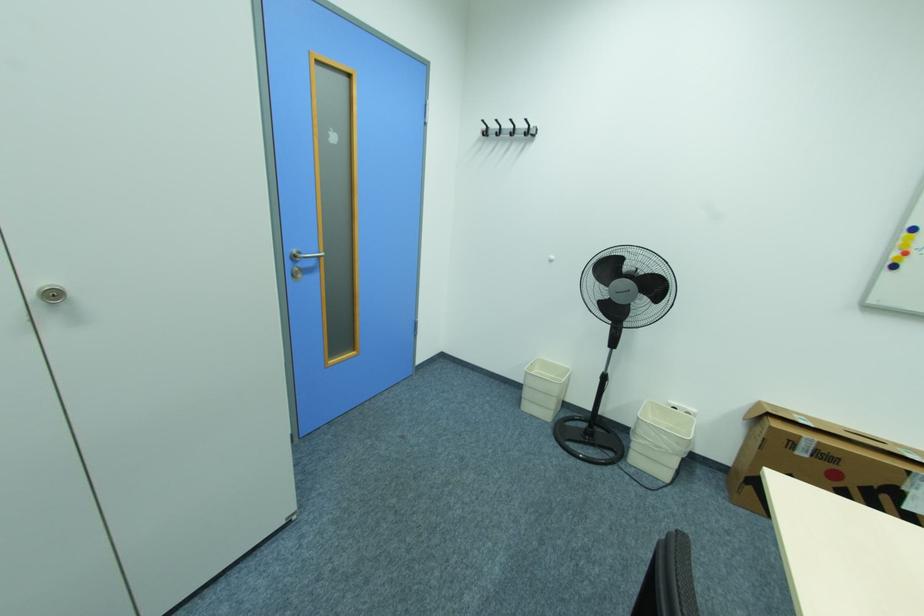
Find where to turn the metal door handle. Please return your answer as a coordinate pair (x, y).

(304, 254)